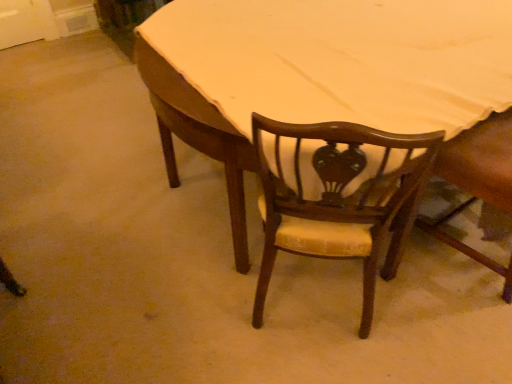
The height and width of the screenshot is (384, 512). Describe the element at coordinates (338, 199) in the screenshot. I see `wooden chair at center, positioned as the 1th chair in left-to-right order` at that location.

Locate an element on the screen. The image size is (512, 384). wooden table at center is located at coordinates (318, 72).

You are a GUI agent. You are given a task and a screenshot of the screen. Output one action in this format:
    pyautogui.click(x=<x>, y=<y>)
    Task: Click on the wooden chair at center, the first chair viewed from the right
    
    Given the screenshot: What is the action you would take?
    pyautogui.click(x=478, y=180)

Does point (458, 147) appear closer or farther from the camera than point (265, 122)?

Clearly, point (458, 147) is more distant from the camera than point (265, 122).

Can you confirm if wooden chair at center, marked as the 2th chair in a left-to-right arrangement, is thinner than wooden chair at center, which is the second chair from right to left?

In fact, wooden chair at center, marked as the 2th chair in a left-to-right arrangement, might be wider than wooden chair at center, which is the second chair from right to left.

Choose the correct answer: Is wooden chair at center, the first chair viewed from the right, inside wooden chair at center, which is the second chair from right to left, or outside it?

wooden chair at center, the first chair viewed from the right, is not enclosed by wooden chair at center, which is the second chair from right to left.

From the image's perspective, between wooden chair at center, the first chair viewed from the right, and wooden chair at center, positioned as the 1th chair in left-to-right order, who is located below?

wooden chair at center, positioned as the 1th chair in left-to-right order, is shown below in the image.

Considering the relative positions of wooden chair at center, positioned as the 1th chair in left-to-right order, and wooden chair at center, the first chair viewed from the right, in the image provided, is wooden chair at center, positioned as the 1th chair in left-to-right order, in front of wooden chair at center, the first chair viewed from the right,?

Yes, wooden chair at center, positioned as the 1th chair in left-to-right order, is in front of wooden chair at center, the first chair viewed from the right.

Which of these two, wooden chair at center, which is the second chair from right to left, or wooden chair at center, the first chair viewed from the right, is thinner?

Thinner between the two is wooden chair at center, which is the second chair from right to left.

Does wooden chair at center, which is the second chair from right to left, have a lesser height compared to wooden chair at center, marked as the 2th chair in a left-to-right arrangement?

Yes.

Is wooden chair at center, which is the second chair from right to left, aimed at wooden chair at center, marked as the 2th chair in a left-to-right arrangement?

No, wooden chair at center, which is the second chair from right to left, does not turn towards wooden chair at center, marked as the 2th chair in a left-to-right arrangement.

Is wooden chair at center, marked as the 2th chair in a left-to-right arrangement, with wooden table at center?

No, wooden chair at center, marked as the 2th chair in a left-to-right arrangement, is not beside wooden table at center.

Between wooden chair at center, the first chair viewed from the right, and wooden table at center, which one has larger width?

wooden table at center is wider.

Is wooden chair at center, marked as the 2th chair in a left-to-right arrangement, looking in the opposite direction of wooden table at center?

Yes, wooden chair at center, marked as the 2th chair in a left-to-right arrangement,'s orientation is away from wooden table at center.

Between wooden table at center and wooden chair at center, the first chair viewed from the right, which one has larger width?

With larger width is wooden table at center.

From a real-world perspective, is wooden table at center physically above wooden chair at center, the first chair viewed from the right?

Incorrect, from a real-world perspective, wooden table at center is lower than wooden chair at center, the first chair viewed from the right.

Considering the sizes of objects wooden table at center and wooden chair at center, marked as the 2th chair in a left-to-right arrangement, in the image provided, who is smaller, wooden table at center or wooden chair at center, marked as the 2th chair in a left-to-right arrangement,?

wooden chair at center, marked as the 2th chair in a left-to-right arrangement.

Which object is positioned more to the right, wooden chair at center, which is the second chair from right to left, or wooden table at center?

From the viewer's perspective, wooden table at center appears more on the right side.

Considering the relative sizes of wooden chair at center, positioned as the 1th chair in left-to-right order, and wooden table at center in the image provided, is wooden chair at center, positioned as the 1th chair in left-to-right order, bigger than wooden table at center?

No.

Can you tell me how much wooden chair at center, positioned as the 1th chair in left-to-right order, and wooden table at center differ in facing direction?

They differ by 37.8 degrees in their facing directions.

Is wooden chair at center, which is the second chair from right to left, facing away from wooden table at center?

That's right, wooden chair at center, which is the second chair from right to left, is facing away from wooden table at center.

How distant is wooden table at center from wooden chair at center, positioned as the 1th chair in left-to-right order?

wooden table at center is 38.80 centimeters from wooden chair at center, positioned as the 1th chair in left-to-right order.

In terms of width, does wooden table at center look wider or thinner when compared to wooden chair at center, positioned as the 1th chair in left-to-right order?

wooden table at center is wider than wooden chair at center, positioned as the 1th chair in left-to-right order.

Would you say wooden table at center is outside wooden chair at center, positioned as the 1th chair in left-to-right order?

Yes, wooden table at center is outside of wooden chair at center, positioned as the 1th chair in left-to-right order.

Is point (362, 69) in front of point (362, 223)?

That is False.

Identify the location of chair above the wooden chair at center, positioned as the 1th chair in left-to-right order (from a real-world perspective). (478, 180).

I want to click on chair below the wooden chair at center, marked as the 2th chair in a left-to-right arrangement (from the image's perspective), so click(x=338, y=199).

From the image, which object appears to be nearer to wooden chair at center, which is the second chair from right to left, wooden table at center or wooden chair at center, marked as the 2th chair in a left-to-right arrangement?

wooden table at center lies closer to wooden chair at center, which is the second chair from right to left, than the other object.

When comparing their distances from wooden chair at center, marked as the 2th chair in a left-to-right arrangement, does wooden table at center or wooden chair at center, positioned as the 1th chair in left-to-right order, seem further?

wooden table at center is positioned further to the anchor wooden chair at center, marked as the 2th chair in a left-to-right arrangement.

Which object lies nearer to the anchor point wooden table at center, wooden chair at center, marked as the 2th chair in a left-to-right arrangement, or wooden chair at center, positioned as the 1th chair in left-to-right order?

wooden chair at center, positioned as the 1th chair in left-to-right order, is closer to wooden table at center.

Estimate the real-world distances between objects in this image. Which object is further from wooden chair at center, which is the second chair from right to left, wooden chair at center, marked as the 2th chair in a left-to-right arrangement, or wooden table at center?

Among the two, wooden chair at center, marked as the 2th chair in a left-to-right arrangement, is located further to wooden chair at center, which is the second chair from right to left.

Considering their positions, is wooden chair at center, which is the second chair from right to left, positioned closer to wooden chair at center, marked as the 2th chair in a left-to-right arrangement, than wooden table at center?

wooden chair at center, which is the second chair from right to left, is closer to wooden chair at center, marked as the 2th chair in a left-to-right arrangement.

Considering their positions, is wooden chair at center, positioned as the 1th chair in left-to-right order, positioned closer to wooden table at center than wooden chair at center, the first chair viewed from the right?

Based on the image, wooden chair at center, positioned as the 1th chair in left-to-right order, appears to be nearer to wooden table at center.

Where is `table situated between wooden chair at center, which is the second chair from right to left, and wooden chair at center, the first chair viewed from the right, from left to right`? table situated between wooden chair at center, which is the second chair from right to left, and wooden chair at center, the first chair viewed from the right, from left to right is located at coordinates (318, 72).